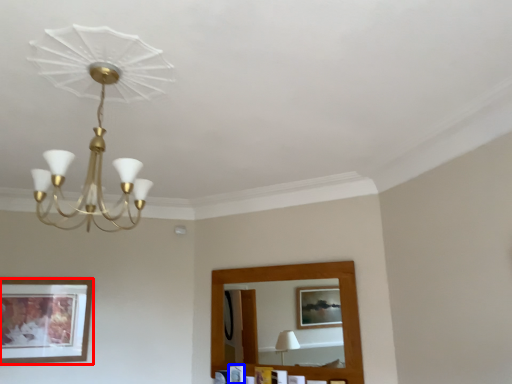
Question: Which object appears closest to the camera in this image, picture frame (highlighted by a red box) or picture frame (highlighted by a blue box)?

Choices:
 (A) picture frame
 (B) picture frame

Answer: (A)